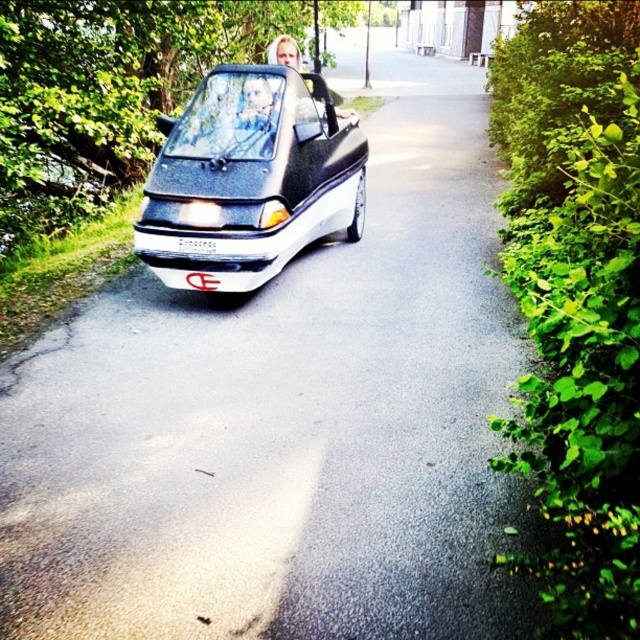
Question: Which point is closer to the camera?

Choices:
 (A) blonde hair at center
 (B) shiny black car at center

Answer: (B)

Question: Observing the image, what is the correct spatial positioning of shiny black car at center in reference to blonde hair at center?

Choices:
 (A) above
 (B) below

Answer: (B)

Question: Observing the image, what is the correct spatial positioning of blonde hair at center in reference to white plastic license plate at center?

Choices:
 (A) below
 (B) above

Answer: (B)

Question: Which of these objects is positioned farthest from the blonde hair at center?

Choices:
 (A) white plastic license plate at center
 (B) shiny black car at center

Answer: (A)

Question: Does blonde hair at center have a lesser width compared to white plastic license plate at center?

Choices:
 (A) yes
 (B) no

Answer: (B)

Question: Which of the following is the farthest from the observer?

Choices:
 (A) shiny black car at center
 (B) blonde hair at center

Answer: (B)